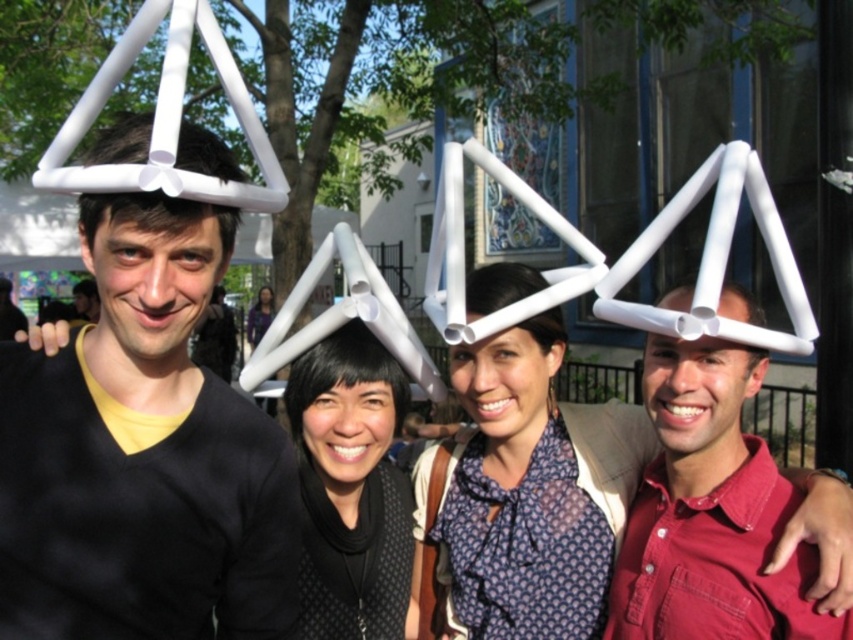
You are a photographer at the event and want to capture a clear photo of the matte black shirt at center without the white matte triangle at right blocking it. Is this possible given their current positions?

The white matte triangle at right is in front of the matte black shirt at center, so it would block the view. To capture a clear photo of the matte black shirt at center without the white matte triangle at right, you would need to adjust their positions or angle the camera so the white matte triangle at right is no longer in front.

You are taking a photo of the group and want to focus on the point at point (231, 637) and point (366, 362). Which point should you adjust your focus to first to ensure both are in clear view?

Point (231, 637) is closer to the camera than point (366, 362). To ensure both are in clear view, focus on the closer point first, which is point (231, 637).

You are a photographer at the event and want to take a photo that includes both the matte black sweater at center and the matte white structure at center. Based on their positions, which one should you focus on first to ensure both are in frame?

The matte black sweater at center is to the left of the matte white structure at center, so you should focus on the matte white structure at center first to ensure both are in frame.